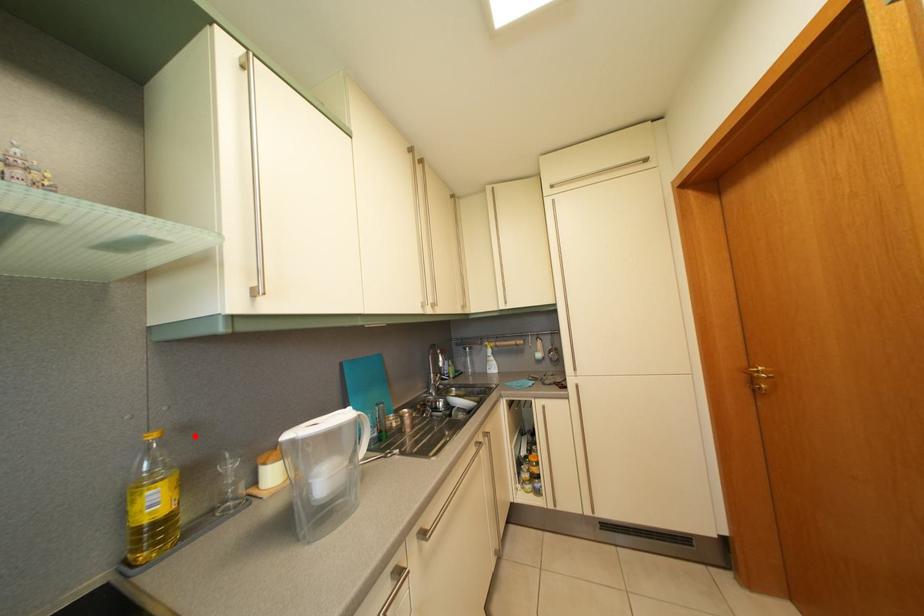
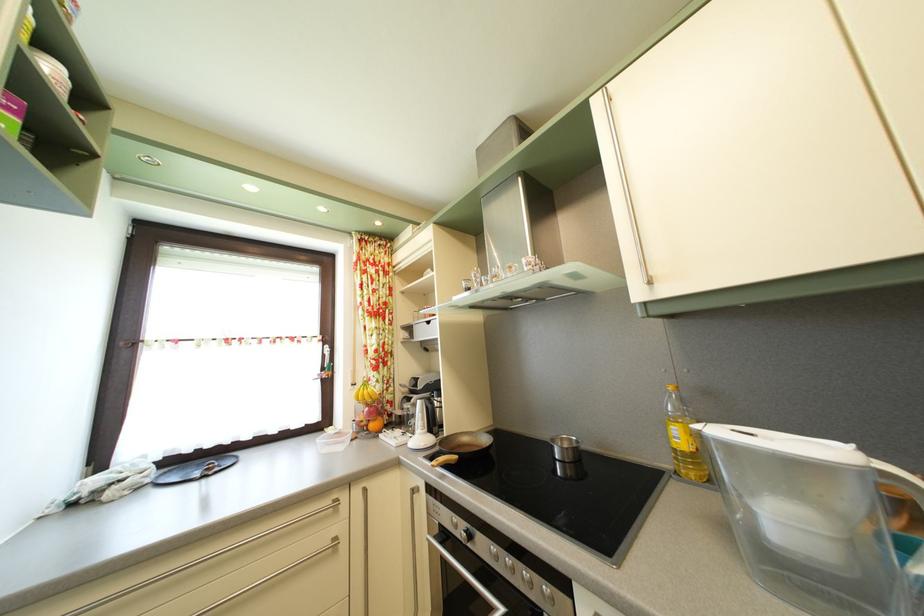
In the second image, find the point that corresponds to the highlighted location in the first image.

(715, 400)